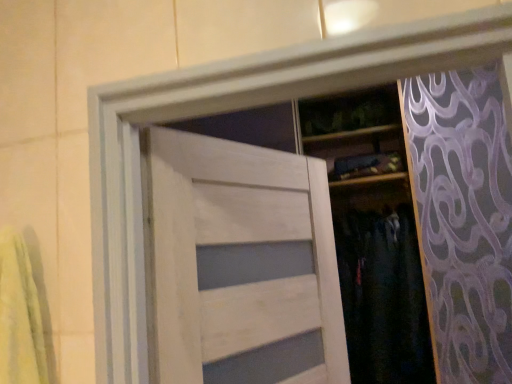
Question: From the image's perspective, is white wood door at center below dark fabric pants at center?

Choices:
 (A) no
 (B) yes

Answer: (A)

Question: Can you confirm if white wood door at center is positioned to the left of dark fabric pants at center?

Choices:
 (A) no
 (B) yes

Answer: (B)

Question: Is white wood door at center facing away from dark fabric pants at center?

Choices:
 (A) no
 (B) yes

Answer: (A)

Question: Is white wood door at center positioned beyond the bounds of dark fabric pants at center?

Choices:
 (A) yes
 (B) no

Answer: (A)

Question: From a real-world perspective, is white wood door at center beneath dark fabric pants at center?

Choices:
 (A) yes
 (B) no

Answer: (B)

Question: Does white wood door at center have a smaller size compared to dark fabric pants at center?

Choices:
 (A) yes
 (B) no

Answer: (A)

Question: Would you consider dark fabric pants at center to be distant from white wood door at center?

Choices:
 (A) no
 (B) yes

Answer: (A)

Question: Can you confirm if dark fabric pants at center is smaller than white wood door at center?

Choices:
 (A) no
 (B) yes

Answer: (A)

Question: From a real-world perspective, is dark fabric pants at center located higher than white wood door at center?

Choices:
 (A) yes
 (B) no

Answer: (B)

Question: Is dark fabric pants at center wider than white wood door at center?

Choices:
 (A) no
 (B) yes

Answer: (B)

Question: Is dark fabric pants at center looking in the opposite direction of white wood door at center?

Choices:
 (A) no
 (B) yes

Answer: (A)

Question: Is dark fabric pants at center not within white wood door at center?

Choices:
 (A) no
 (B) yes

Answer: (B)

Question: Considering the positions of point (201, 309) and point (345, 231), is point (201, 309) closer or farther from the camera than point (345, 231)?

Choices:
 (A) closer
 (B) farther

Answer: (A)